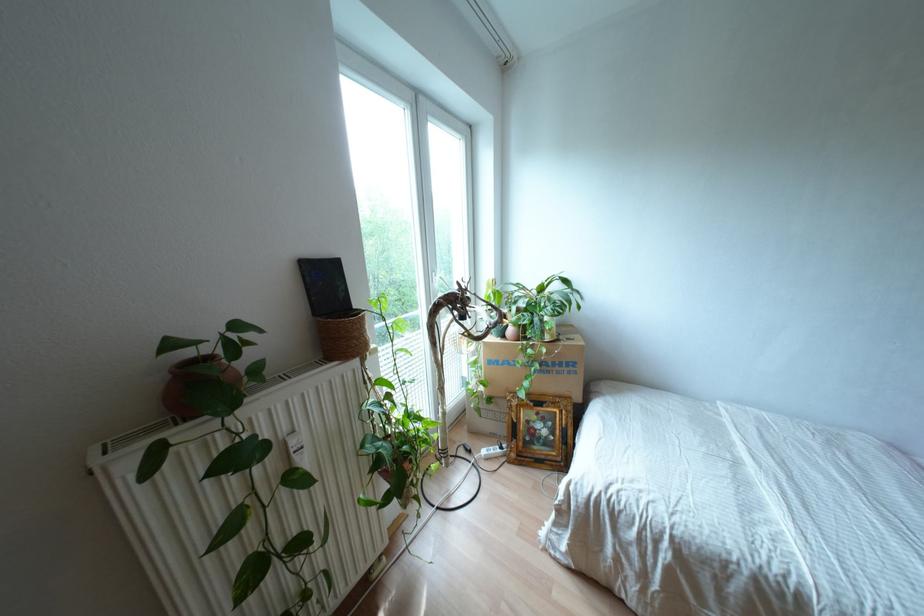
Describe the element at coordinates (297, 450) in the screenshot. I see `a white radiator knob` at that location.